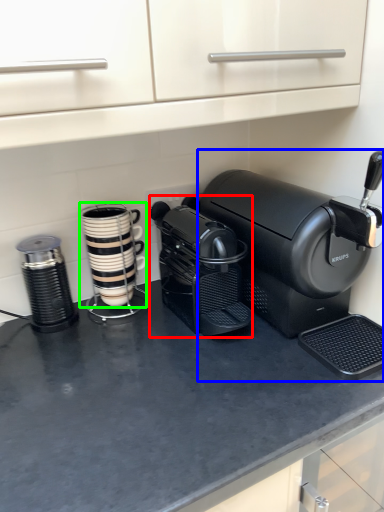
Question: Which object is the farthest from coffee maker (highlighted by a red box)? Choose among these: coffee maker (highlighted by a blue box) or kitchen appliance (highlighted by a green box).

Choices:
 (A) coffee maker
 (B) kitchen appliance

Answer: (B)